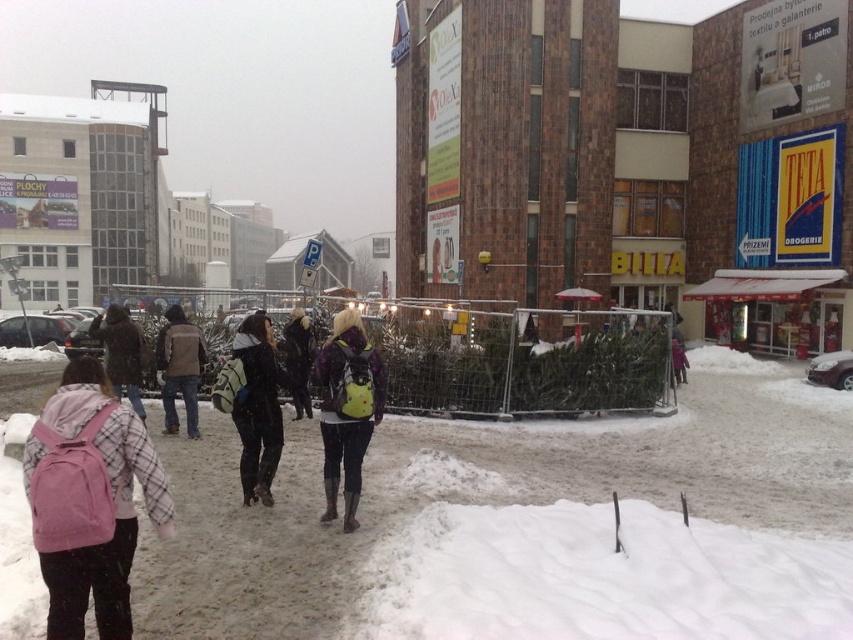
Question: Which object is the farthest from the yellow backpack at center?

Choices:
 (A) dark blue jeans at center
 (B) brown leather jacket at center
 (C) pink backpack at left

Answer: (A)

Question: Does matte yellow backpack at center appear over brown leather jacket at center?

Choices:
 (A) no
 (B) yes

Answer: (A)

Question: Does white fluffy snow at lower left have a lesser width compared to yellow backpack at center?

Choices:
 (A) yes
 (B) no

Answer: (B)

Question: Which object is positioned farthest from the brown leather jacket at center?

Choices:
 (A) pink backpack at left
 (B) dark blue jeans at center
 (C) pink fabric backpack at left

Answer: (C)

Question: Does matte yellow backpack at center have a greater width compared to brown leather jacket at center?

Choices:
 (A) yes
 (B) no

Answer: (B)

Question: Which point is farther from the camera taking this photo?

Choices:
 (A) (47, 560)
 (B) (706, 531)

Answer: (B)